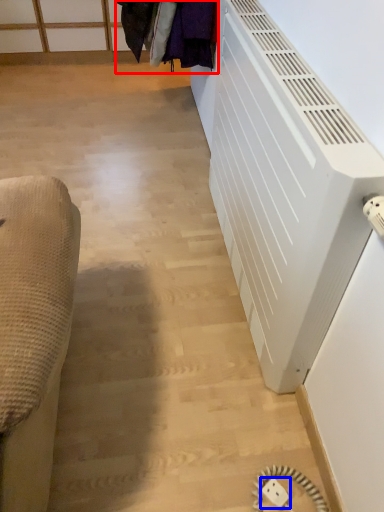
Question: Which of the following is the closest to the observer, laundry (highlighted by a red box) or electric outlet (highlighted by a blue box)?

Choices:
 (A) laundry
 (B) electric outlet

Answer: (B)